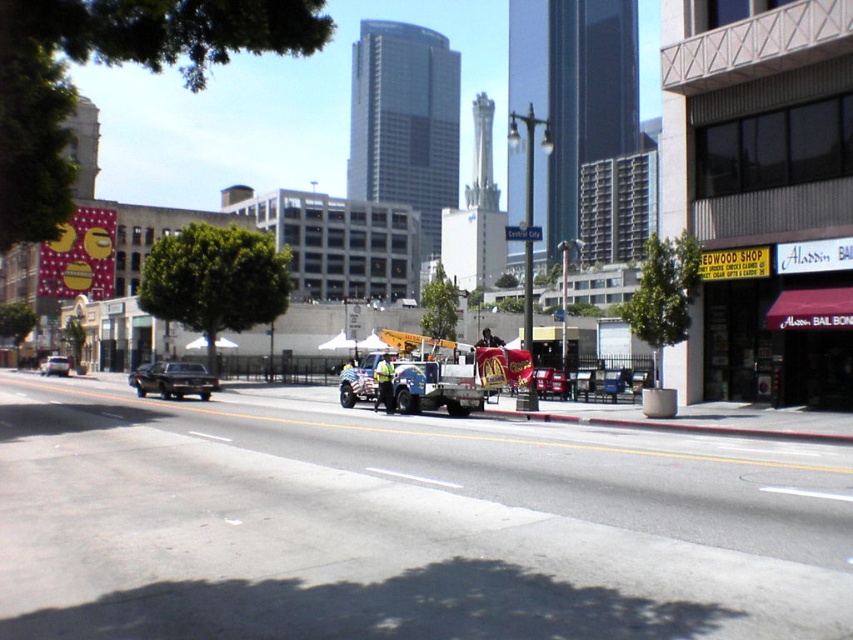
Who is more forward, (x=200, y=368) or (x=61, y=364)?

Point (x=200, y=368)

Which is more to the left, matte black truck at left or shiny silver sedan at center-left?

shiny silver sedan at center-left

What do you see at coordinates (172, 380) in the screenshot? The width and height of the screenshot is (853, 640). I see `matte black truck at left` at bounding box center [172, 380].

You are a GUI agent. You are given a task and a screenshot of the screen. Output one action in this format:
    pyautogui.click(x=<x>, y=<y>)
    Task: Click on the matte black truck at left
    
    Given the screenshot: What is the action you would take?
    pyautogui.click(x=172, y=380)

Does metallic blue tow truck at center appear over metallic silver car at center?

Indeed, metallic blue tow truck at center is positioned over metallic silver car at center.

What are the coordinates of `metallic blue tow truck at center` in the screenshot? It's located at (433, 374).

Which is more to the right, matte black truck at left or metallic silver car at center?

metallic silver car at center

Between point (184, 371) and point (555, 394), which one is positioned in front?

Point (555, 394) is in front.

Image resolution: width=853 pixels, height=640 pixels. In order to click on matte black truck at left in this screenshot , I will do `click(172, 380)`.